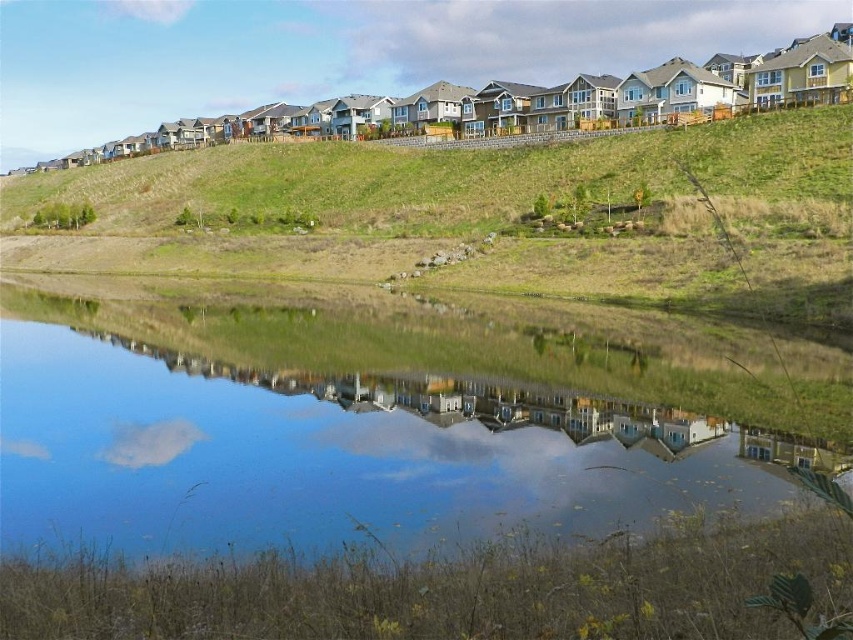
Question: Does transparent glass water at center lie in front of green grassy hillside at upper center?

Choices:
 (A) no
 (B) yes

Answer: (B)

Question: Which point is farther to the camera?

Choices:
 (A) green grassy hillside at upper center
 (B) transparent glass water at center

Answer: (A)

Question: Does transparent glass water at center appear under green grassy hillside at upper center?

Choices:
 (A) no
 (B) yes

Answer: (B)

Question: Can you confirm if transparent glass water at center is smaller than green grassy hillside at upper center?

Choices:
 (A) yes
 (B) no

Answer: (A)

Question: Which of the following is the closest to the observer?

Choices:
 (A) (740, 310)
 (B) (39, 516)

Answer: (B)

Question: Which point is closer to the camera?

Choices:
 (A) (732, 456)
 (B) (492, 264)

Answer: (A)